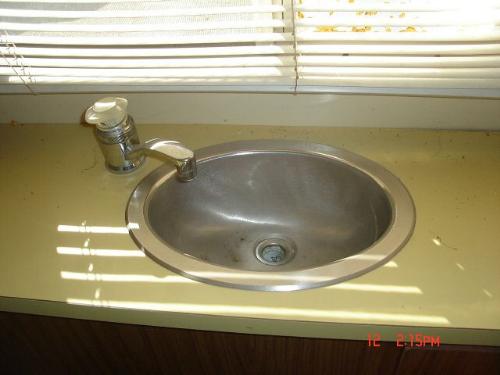
The width and height of the screenshot is (500, 375). In order to click on oval sink in this screenshot , I will do `click(205, 211)`.